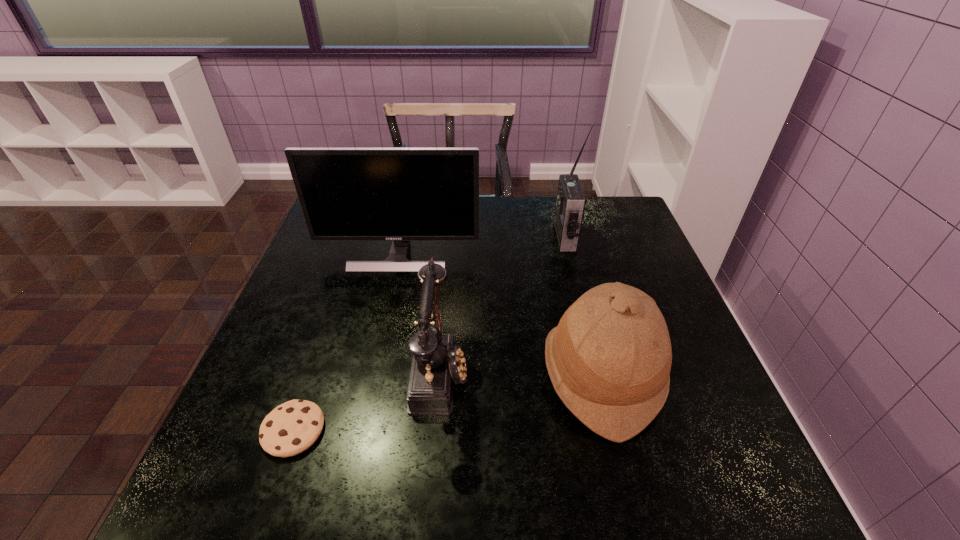
The width and height of the screenshot is (960, 540). I want to click on radio receiver, so click(570, 205).

This screenshot has width=960, height=540. Identify the location of monitor. (400, 194).

Locate an element on the screen. hat is located at coordinates (609, 359).

Identify the location of telephone. This screenshot has height=540, width=960. (437, 363).

Image resolution: width=960 pixels, height=540 pixels. I want to click on the shortest object, so click(x=292, y=427).

At what (x,y) coordinates should I click in order to perform the action: click on free space located 0.160m on the display of the radio receiver. Please return your answer as a coordinate pair (x, y). Looking at the image, I should click on (501, 237).

Identify the location of vacant area situated on the display of the radio receiver. (432, 237).

This screenshot has height=540, width=960. I want to click on vacant space situated on the display of the radio receiver, so click(x=501, y=237).

The image size is (960, 540). I want to click on free region located 0.240m on the screen side of the monitor, so click(x=380, y=341).

You are a GUI agent. You are given a task and a screenshot of the screen. Output one action in this format:
    pyautogui.click(x=<x>, y=<y>)
    Task: Click on the vacant space located on the front-facing side of the hat
    Image resolution: width=960 pixels, height=540 pixels.
    Given the screenshot: What is the action you would take?
    pyautogui.click(x=491, y=374)